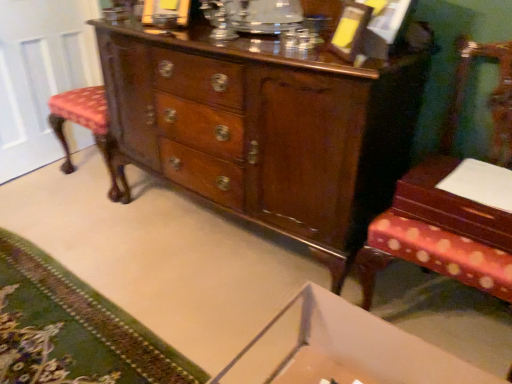
At what (x,y) coordinates should I click in order to perform the action: click on vacant space behind white cardboard changing table at lower center. Please return your answer as a coordinate pair (x, y). Looking at the image, I should click on (254, 308).